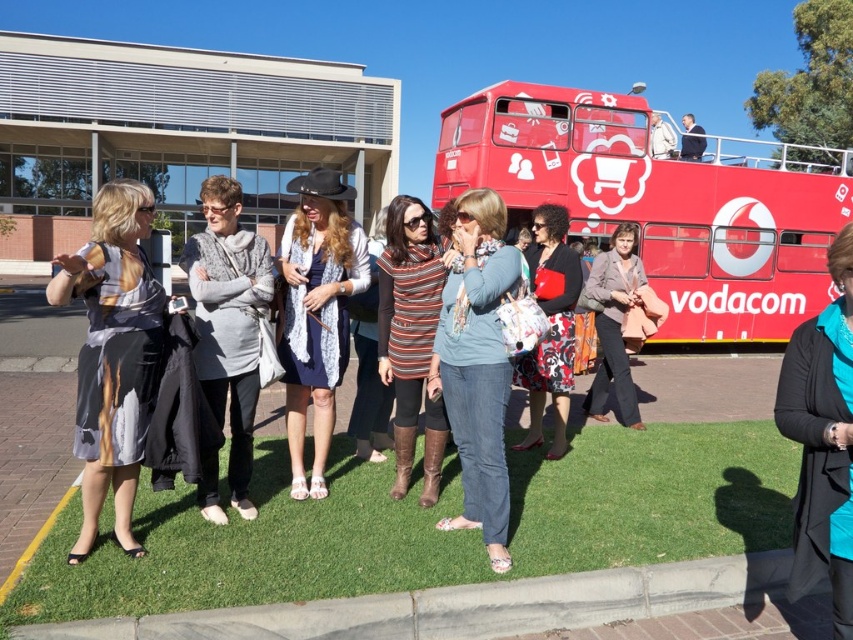
Question: Estimate the real-world distances between objects in this image. Which object is closer to the red matte double-decker bus at upper right?

Choices:
 (A) denim jeans at center
 (B) green grass at lower center

Answer: (A)

Question: Does red matte double-decker bus at upper right appear over floral-patterned dress at center?

Choices:
 (A) yes
 (B) no

Answer: (A)

Question: Is denim jeans at center positioned at the back of floral-patterned dress at center?

Choices:
 (A) yes
 (B) no

Answer: (B)

Question: Can you confirm if striped knit sweater at center is smaller than floral-patterned dress at center?

Choices:
 (A) yes
 (B) no

Answer: (A)

Question: Among these objects, which one is farthest from the camera?

Choices:
 (A) teal satin jacket at center
 (B) denim jeans at center

Answer: (B)

Question: Which point is closer to the camera taking this photo?

Choices:
 (A) (624, 397)
 (B) (345, 208)
 (C) (550, 227)
 (D) (83, 509)

Answer: (D)